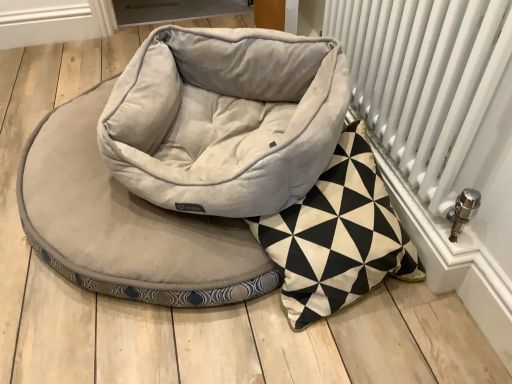
Describe the element at coordinates (424, 79) in the screenshot. I see `white metal radiator at right` at that location.

Find the location of a particular element. Image resolution: width=512 pixels, height=384 pixels. white metal radiator at right is located at coordinates (424, 79).

What is the approximate width of suede-like beige dog bed at center?

suede-like beige dog bed at center is 91.70 centimeters in width.

Find the location of `suede-like beige dog bed at center`. suede-like beige dog bed at center is located at coordinates (183, 163).

Image resolution: width=512 pixels, height=384 pixels. Describe the element at coordinates (183, 163) in the screenshot. I see `suede-like beige dog bed at center` at that location.

Locate an element on the screen. white metal radiator at right is located at coordinates click(x=424, y=79).

Between suede-like beige dog bed at center and white metal radiator at right, which one appears on the right side from the viewer's perspective?

From the viewer's perspective, white metal radiator at right appears more on the right side.

Considering their positions, is suede-like beige dog bed at center located in front of or behind white metal radiator at right?

Clearly, suede-like beige dog bed at center is behind white metal radiator at right.

Which is in front, point (212, 125) or point (393, 11)?

The point (393, 11) is closer to the camera.

From the image's perspective, which one is positioned lower, suede-like beige dog bed at center or white metal radiator at right?

suede-like beige dog bed at center appears lower in the image.

From a real-world perspective, is suede-like beige dog bed at center on white metal radiator at right?

No, from a real-world perspective, suede-like beige dog bed at center is not above white metal radiator at right.

Is suede-like beige dog bed at center thinner than white metal radiator at right?

Incorrect, the width of suede-like beige dog bed at center is not less than that of white metal radiator at right.

Considering the sizes of objects suede-like beige dog bed at center and white metal radiator at right in the image provided, who is shorter, suede-like beige dog bed at center or white metal radiator at right?

suede-like beige dog bed at center is shorter.

Considering the relative sizes of suede-like beige dog bed at center and white metal radiator at right in the image provided, is suede-like beige dog bed at center smaller than white metal radiator at right?

No, suede-like beige dog bed at center is not smaller than white metal radiator at right.

From the picture: Is suede-like beige dog bed at center not within white metal radiator at right?

suede-like beige dog bed at center is positioned outside white metal radiator at right.

Are suede-like beige dog bed at center and white metal radiator at right far apart?

suede-like beige dog bed at center is near white metal radiator at right, not far away.

Is suede-like beige dog bed at center positioned with its back to white metal radiator at right?

No, white metal radiator at right is not at the back of suede-like beige dog bed at center.

How different are the orientations of suede-like beige dog bed at center and white metal radiator at right in degrees?

They differ by 0.387 degrees in their facing directions.

Where is `radiator above the suede-like beige dog bed at center (from the image's perspective)`? radiator above the suede-like beige dog bed at center (from the image's perspective) is located at coordinates (424, 79).

Can you confirm if white metal radiator at right is positioned to the left of suede-like beige dog bed at center?

In fact, white metal radiator at right is to the right of suede-like beige dog bed at center.

Considering their positions, is white metal radiator at right located in front of or behind suede-like beige dog bed at center?

white metal radiator at right is positioned closer to the viewer than suede-like beige dog bed at center.

Does point (400, 90) appear closer or farther from the camera than point (31, 147)?

Point (400, 90) is positioned closer to the camera compared to point (31, 147).

From the image's perspective, which object appears higher, white metal radiator at right or suede-like beige dog bed at center?

white metal radiator at right is shown above in the image.

Based on the photo, from a real-world perspective, who is located higher, white metal radiator at right or suede-like beige dog bed at center?

white metal radiator at right is physically above.

In terms of width, does white metal radiator at right look wider or thinner when compared to suede-like beige dog bed at center?

Clearly, white metal radiator at right has less width compared to suede-like beige dog bed at center.

Who is taller, white metal radiator at right or suede-like beige dog bed at center?

Result: white metal radiator at right is taller.

Considering the relative sizes of white metal radiator at right and suede-like beige dog bed at center in the image provided, is white metal radiator at right smaller than suede-like beige dog bed at center?

Yes.

Is suede-like beige dog bed at center inside white metal radiator at right?

No.

Is white metal radiator at right beside suede-like beige dog bed at center?

No, white metal radiator at right is not touching suede-like beige dog bed at center.

Could you tell me if white metal radiator at right is turned towards suede-like beige dog bed at center?

Yes.

What's the angular difference between white metal radiator at right and suede-like beige dog bed at center's facing directions?

They differ by 0.387 degrees in their facing directions.

How far apart are white metal radiator at right and suede-like beige dog bed at center?

white metal radiator at right is 16.99 inches from suede-like beige dog bed at center.

What are the coordinates of `radiator in front of the suede-like beige dog bed at center` in the screenshot? It's located at (424, 79).

I want to click on dog bed located behind the white metal radiator at right, so click(183, 163).

The image size is (512, 384). In order to click on radiator above the suede-like beige dog bed at center (from the image's perspective) in this screenshot , I will do 424,79.